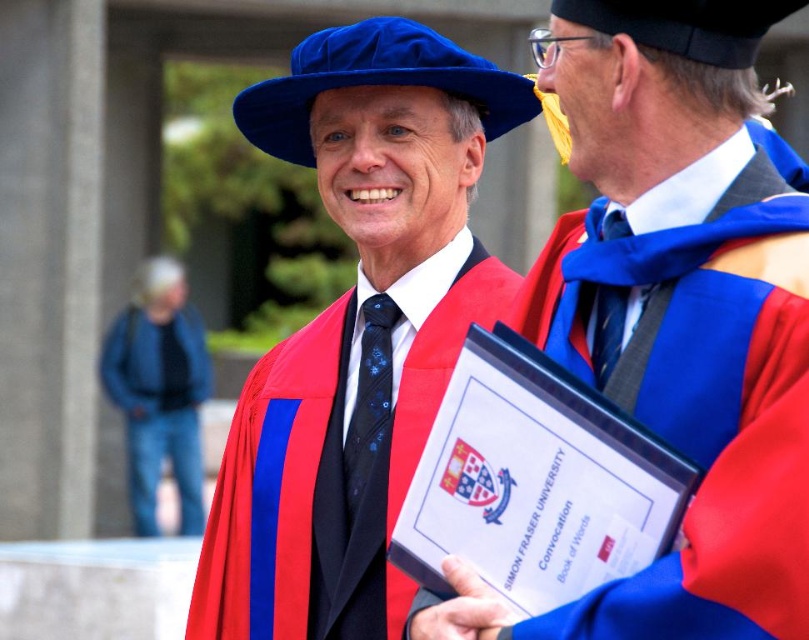
What is the location of the point with coordinates (159, 390) in the image?

The point with coordinates (159, 390) is located on the blue denim jeans at lower left.

You are a photographer at the graduation ceremony. You need to ensure that both the matte black suit at center and the matte blue tie at upper right are clearly visible in the photo. Given their sizes, which one might you need to adjust your camera focus on more carefully to avoid blurriness?

The matte black suit at center has a greater height compared to the matte blue tie at upper right, so you should focus more carefully on the matte black suit at center to ensure clarity due to its larger size.